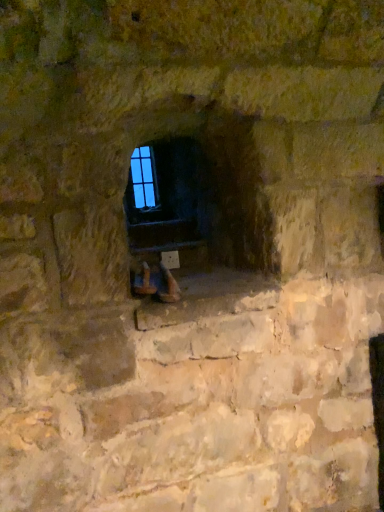
Measure the distance between point (229,200) and camera.

Point (229,200) is 5.79 feet away from camera.

Identify the location of smooth stone fireplace at center. This screenshot has width=384, height=512. (208, 195).

What do you see at coordinates (208, 195) in the screenshot? I see `smooth stone fireplace at center` at bounding box center [208, 195].

Looking at this image, what is the approximate width of blue glass window at center?

The width of blue glass window at center is 2.98 centimeters.

Describe the element at coordinates (142, 182) in the screenshot. The image size is (384, 512). I see `blue glass window at center` at that location.

Locate an element on the screen. The height and width of the screenshot is (512, 384). blue glass window at center is located at coordinates (142, 182).

Find the location of a particular element. This screenshot has width=384, height=512. smooth stone fireplace at center is located at coordinates (208, 195).

Between smooth stone fireplace at center and blue glass window at center, which one appears on the right side from the viewer's perspective?

smooth stone fireplace at center is more to the right.

Is smooth stone fireplace at center further to camera compared to blue glass window at center?

No, smooth stone fireplace at center is closer to the camera.

Between point (174, 211) and point (149, 207), which one is positioned behind?

The point (149, 207) is behind.

From the image's perspective, which is below, smooth stone fireplace at center or blue glass window at center?

smooth stone fireplace at center appears lower in the image.

From a real-world perspective, which is physically above, smooth stone fireplace at center or blue glass window at center?

From a 3D spatial view, blue glass window at center is above.

Is smooth stone fireplace at center thinner than blue glass window at center?

No, smooth stone fireplace at center is not thinner than blue glass window at center.

Can you confirm if smooth stone fireplace at center is shorter than blue glass window at center?

In fact, smooth stone fireplace at center may be taller than blue glass window at center.

Considering the sizes of objects smooth stone fireplace at center and blue glass window at center in the image provided, who is smaller, smooth stone fireplace at center or blue glass window at center?

With smaller size is blue glass window at center.

Is smooth stone fireplace at center situated inside blue glass window at center or outside?

smooth stone fireplace at center is located beyond the bounds of blue glass window at center.

Is smooth stone fireplace at center far away from blue glass window at center?

smooth stone fireplace at center is actually quite close to blue glass window at center.

Is smooth stone fireplace at center positioned with its back to blue glass window at center?

No, smooth stone fireplace at center is not facing away from blue glass window at center.

You are a GUI agent. You are given a task and a screenshot of the screen. Output one action in this format:
    pyautogui.click(x=<x>, y=<y>)
    Task: Click on the window above the smooth stone fireplace at center (from a real-world perspective)
    The height and width of the screenshot is (512, 384).
    Given the screenshot: What is the action you would take?
    pyautogui.click(x=142, y=182)

Considering the positions of objects blue glass window at center and smooth stone fireplace at center in the image provided, who is more to the left, blue glass window at center or smooth stone fireplace at center?

From the viewer's perspective, blue glass window at center appears more on the left side.

Is blue glass window at center positioned in front of smooth stone fireplace at center?

No, it is behind smooth stone fireplace at center.

Which is behind, point (138, 192) or point (179, 187)?

The point (138, 192) is farther from the camera.

From the image's perspective, would you say blue glass window at center is positioned over smooth stone fireplace at center?

Indeed, from the image's perspective, blue glass window at center is shown above smooth stone fireplace at center.

From a real-world perspective, which is physically above, blue glass window at center or smooth stone fireplace at center?

In real-world perspective, blue glass window at center is above.

Between blue glass window at center and smooth stone fireplace at center, which one has smaller width?

blue glass window at center.

Is blue glass window at center taller than smooth stone fireplace at center?

No.

Considering the sizes of blue glass window at center and smooth stone fireplace at center in the image, is blue glass window at center bigger or smaller than smooth stone fireplace at center?

In the image, blue glass window at center appears to be smaller than smooth stone fireplace at center.

Is blue glass window at center inside or outside of smooth stone fireplace at center?

blue glass window at center is spatially situated outside smooth stone fireplace at center.

Are blue glass window at center and smooth stone fireplace at center beside each other?

blue glass window at center and smooth stone fireplace at center are clearly separated.

Is blue glass window at center oriented towards smooth stone fireplace at center?

Yes, blue glass window at center is oriented towards smooth stone fireplace at center.

How different are the orientations of blue glass window at center and smooth stone fireplace at center in degrees?

The facing directions of blue glass window at center and smooth stone fireplace at center are 86.1 degrees apart.

Locate an element on the screen. The height and width of the screenshot is (512, 384). fireplace on the right of blue glass window at center is located at coordinates (208, 195).

Identify the location of window that appears above the smooth stone fireplace at center (from a real-world perspective). (142, 182).

Locate an element on the screen. fireplace in front of the blue glass window at center is located at coordinates (208, 195).